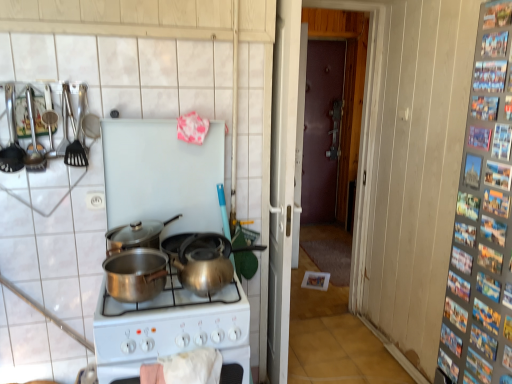
This screenshot has height=384, width=512. What do you see at coordinates (321, 129) in the screenshot?
I see `dark brown wood door at center` at bounding box center [321, 129].

Locate an element on the screen. The height and width of the screenshot is (384, 512). shiny metallic kettle at center is located at coordinates (204, 263).

Looking at this image, is white plastic screen door at center further to camera compared to shiny silver wok at center?

No, the depth of white plastic screen door at center is less than that of shiny silver wok at center.

Can you tell me how much white plastic screen door at center and shiny silver wok at center differ in facing direction?

91.5 degrees.

From the image's perspective, relative to shiny silver wok at center, is white plastic screen door at center above or below?

From the image's perspective, white plastic screen door at center appears above shiny silver wok at center.

Consider the image. Considering the relative sizes of white plastic screen door at center and shiny silver wok at center in the image provided, is white plastic screen door at center thinner than shiny silver wok at center?

Correct, the width of white plastic screen door at center is less than that of shiny silver wok at center.

From the picture: Is shiny silver pot at center, acting as the second kitchen appliance starting from the right, completely or partially inside shiny metallic kettle at center?

Actually, shiny silver pot at center, acting as the second kitchen appliance starting from the right, is outside shiny metallic kettle at center.

Is shiny metallic kettle at center positioned in front of shiny silver pot at center, which is the third kitchen appliance from left to right?

Yes, shiny metallic kettle at center is in front of shiny silver pot at center, which is the third kitchen appliance from left to right.

Can you see shiny metallic kettle at center touching shiny silver pot at center, which is the third kitchen appliance from left to right?

No.

Locate an element on the screen. The image size is (512, 384). crock pot in front of the shiny silver pot at center, acting as the second kitchen appliance starting from the right is located at coordinates pos(204,263).

In the image, there is a shiny silver pot at center, acting as the second kitchen appliance starting from the right. Identify the location of screen door below it (from a real-world perspective). (282, 183).

Is white plastic screen door at center positioned with its back to shiny silver pot at center, which is the third kitchen appliance from left to right?

Yes, white plastic screen door at center is positioned with its back facing shiny silver pot at center, which is the third kitchen appliance from left to right.

Is white plastic screen door at center taller than shiny silver pot at center, acting as the second kitchen appliance starting from the right?

Indeed, white plastic screen door at center has a greater height compared to shiny silver pot at center, acting as the second kitchen appliance starting from the right.

Is point (284, 356) positioned after point (103, 308)?

Yes, point (284, 356) is farther from viewer.

Is white plastic screen door at center inside the boundaries of shiny metallic kettle at center, or outside?

white plastic screen door at center is outside shiny metallic kettle at center.

In the scene shown: Does white plastic screen door at center have a lesser height compared to shiny metallic kettle at center?

In fact, white plastic screen door at center may be taller than shiny metallic kettle at center.

From the image's perspective, is white plastic screen door at center on top of shiny metallic kettle at center?

Indeed, from the image's perspective, white plastic screen door at center is shown above shiny metallic kettle at center.

Is shiny metallic kettle at center turned away from shiny metallic kettle at center?

No, shiny metallic kettle at center's orientation is not away from shiny metallic kettle at center.

Can you confirm if shiny metallic kettle at center is smaller than shiny metallic kettle at center?

Incorrect, shiny metallic kettle at center is not smaller in size than shiny metallic kettle at center.

Measure the distance from shiny metallic kettle at center to shiny metallic kettle at center.

shiny metallic kettle at center is 17.31 centimeters away from shiny metallic kettle at center.

Who is taller, shiny metallic kettle at center or shiny metallic kettle at center?

shiny metallic kettle at center is taller.

Choose the correct answer: Is shiny silver wok at center inside polished stainless steel pot at center, which is the 1th kitchen appliance from right to left, or outside it?

shiny silver wok at center is outside polished stainless steel pot at center, which is the 1th kitchen appliance from right to left.

Find the location of `wok located above the polished stainless steel pot at center, which is the 1th kitchen appliance from right to left (from the image's perspective)`. wok located above the polished stainless steel pot at center, which is the 1th kitchen appliance from right to left (from the image's perspective) is located at coordinates (220, 244).

Is there a large distance between shiny silver wok at center and polished stainless steel pot at center, the fourth kitchen appliance from the left?

shiny silver wok at center is actually quite close to polished stainless steel pot at center, the fourth kitchen appliance from the left.

From the picture: Is polished stainless steel pot at center, which is the 1th kitchen appliance from right to left, not within white plastic screen door at center?

That's correct, polished stainless steel pot at center, which is the 1th kitchen appliance from right to left, is outside of white plastic screen door at center.

Can you confirm if polished stainless steel pot at center, which is the 1th kitchen appliance from right to left, is shorter than white plastic screen door at center?

Yes.

From the image's perspective, which object appears higher, polished stainless steel pot at center, the fourth kitchen appliance from the left, or white plastic screen door at center?

white plastic screen door at center, from the image's perspective.

Based on the photo, considering their positions, is polished stainless steel pot at center, the fourth kitchen appliance from the left, located in front of or behind white plastic screen door at center?

Visually, polished stainless steel pot at center, the fourth kitchen appliance from the left, is located in front of white plastic screen door at center.

Locate an element on the screen. This screenshot has width=512, height=384. wok to the left of white plastic screen door at center is located at coordinates (220, 244).

Find the location of a particular element. crock pot on the right of shiny silver pot at center, acting as the second kitchen appliance starting from the right is located at coordinates (204, 263).

From the picture: Estimate the real-world distances between objects in this image. Which object is further from shiny silver pot at center, acting as the second kitchen appliance starting from the right, polished stainless steel pot at center, which is the 1th kitchen appliance from right to left, or shiny silver wok at center?

Based on the image, shiny silver wok at center appears to be further to shiny silver pot at center, acting as the second kitchen appliance starting from the right.

When comparing their distances from metallic spatula at left, which is the first kitchen appliance in left-to-right order, does shiny silver wok at center or dark brown wood door at center seem closer?

shiny silver wok at center lies closer to metallic spatula at left, which is the first kitchen appliance in left-to-right order, than the other object.

Estimate the real-world distances between objects in this image. Which object is further from shiny metallic kettle at center, white plastic screen door at center or shiny metallic kettle at center?

white plastic screen door at center.

In the scene shown: From the image, which object appears to be farther from shiny metallic kettle at center, shiny silver pot at center, acting as the second kitchen appliance starting from the right, or shiny metallic kettle at center?

Among the two, shiny silver pot at center, acting as the second kitchen appliance starting from the right, is located further to shiny metallic kettle at center.

Consider the image. Looking at the image, which one is located further to shiny metallic kettle at center, metallic utensils at upper left, which appears as the third kitchen appliance when viewed from the right, or polished stainless steel pot at center, the fourth kitchen appliance from the left?

Based on the image, metallic utensils at upper left, which appears as the third kitchen appliance when viewed from the right, appears to be further to shiny metallic kettle at center.

Looking at the image, which one is located closer to shiny metallic kettle at center, metallic spatula at left, the fourth kitchen appliance from the right, or white plastic screen door at center?

Based on the image, white plastic screen door at center appears to be nearer to shiny metallic kettle at center.

Considering their positions, is metallic utensils at upper left, which appears as the third kitchen appliance when viewed from the right, positioned further to shiny silver pot at center, acting as the second kitchen appliance starting from the right, than dark brown wood door at center?

dark brown wood door at center lies further to shiny silver pot at center, acting as the second kitchen appliance starting from the right, than the other object.

Looking at the image, which one is located closer to metallic spatula at left, which is the first kitchen appliance in left-to-right order, white plastic screen door at center or metallic utensils at upper left, which appears as the third kitchen appliance when viewed from the right?

Among the two, metallic utensils at upper left, which appears as the third kitchen appliance when viewed from the right, is located nearer to metallic spatula at left, which is the first kitchen appliance in left-to-right order.

What are the coordinates of `screen door located between polished stainless steel pot at center, the fourth kitchen appliance from the left, and dark brown wood door at center in the depth direction` in the screenshot? It's located at (282, 183).

The image size is (512, 384). In order to click on crock pot between shiny metallic kettle at center and dark brown wood door at center from front to back in this screenshot , I will do `click(204, 263)`.

Find the location of a particular element. Image resolution: width=512 pixels, height=384 pixels. wok between metallic utensils at upper left, the 2th kitchen appliance positioned from the left, and white plastic screen door at center, in the horizontal direction is located at coordinates (220, 244).

Image resolution: width=512 pixels, height=384 pixels. Find the location of `wok between shiny metallic kettle at center and white plastic screen door at center`. wok between shiny metallic kettle at center and white plastic screen door at center is located at coordinates (220, 244).